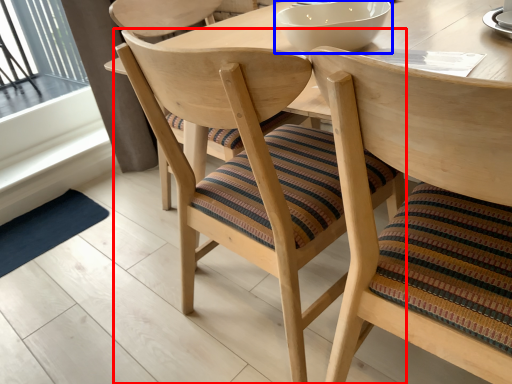
Question: Among these objects, which one is nearest to the camera, chair (highlighted by a red box) or bowl (highlighted by a blue box)?

Choices:
 (A) chair
 (B) bowl

Answer: (A)